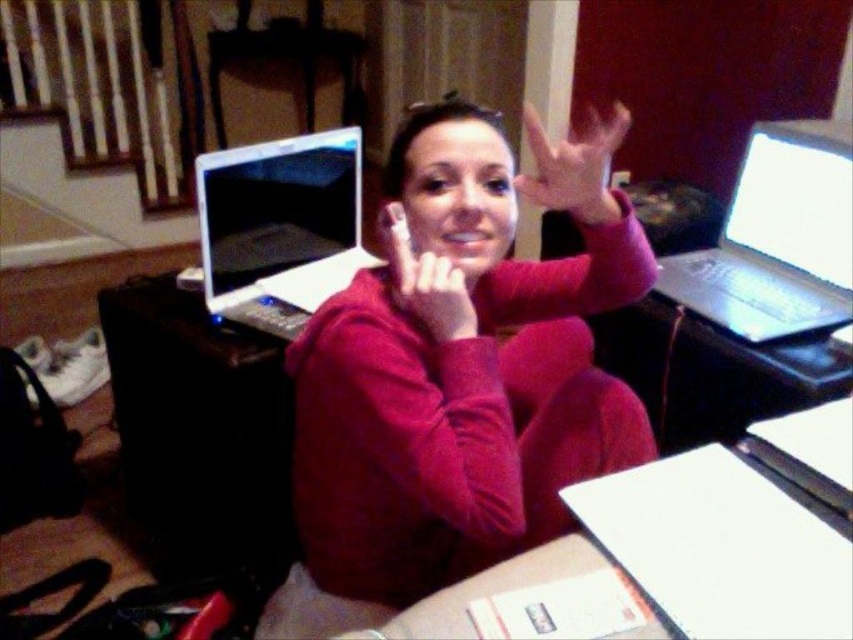
You are trying to place the matte pink hand at upper center on top of the white plastic laptop at center. Will it fit without hanging over the edges?

The white plastic laptop at center might be wider than matte pink hand at upper center, so it might fit without hanging over the edges, but there is uncertainty due to the word

You are a photographer taking a picture of the scene. The white plastic laptop at center and the matte pink hand at upper center are both in the frame. Which object is closer to the camera?

The matte pink hand at upper center is closer to the camera because it is above the white plastic laptop at center, which is positioned below it.

You are organizing a desk and need to place a new item between the white plastic laptop at center and the matte pink fabric at lower center. Based on their positions, where should you place the new item?

The white plastic laptop at center is above the matte pink fabric at lower center, so you should place the new item between them either below the laptop and above the fabric or in the space between their positions.